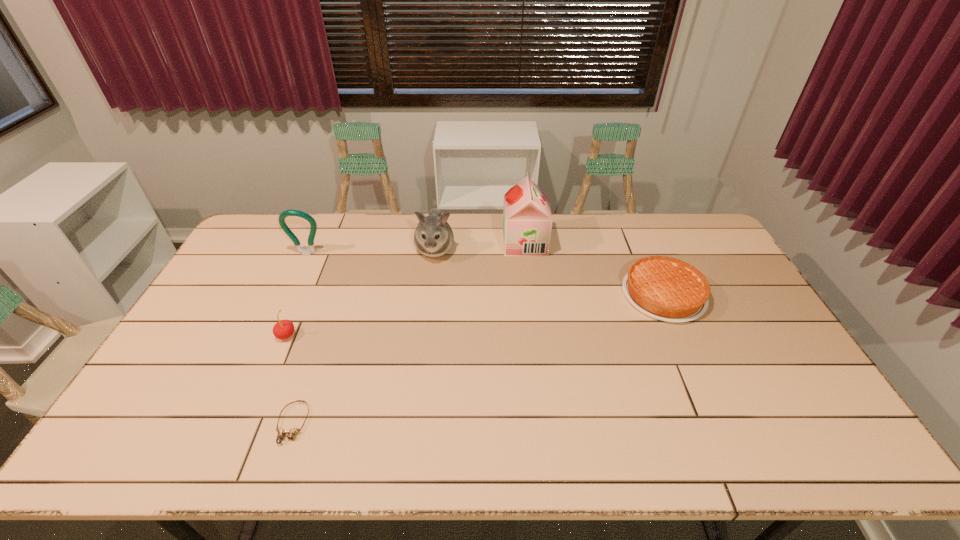
Image resolution: width=960 pixels, height=540 pixels. What are the coordinates of `object that is at the near edge` in the screenshot? It's located at (292, 433).

In order to click on object that is at the right edge in this screenshot , I will do `click(664, 288)`.

In the image, there is a desktop. Find the location of `vacant space at the far edge`. vacant space at the far edge is located at coordinates (651, 232).

Identify the location of vacant space at the left edge of the desktop. The image size is (960, 540). (240, 257).

Where is `free space at the right edge of the desktop`? The height and width of the screenshot is (540, 960). free space at the right edge of the desktop is located at coordinates (752, 365).

You are a GUI agent. You are given a task and a screenshot of the screen. Output one action in this format:
    pyautogui.click(x=<x>, y=<y>)
    Task: Click on the vacant space at the near left corner of the desktop
    This screenshot has height=540, width=960.
    Given the screenshot: What is the action you would take?
    pyautogui.click(x=158, y=435)

Where is `unoccupied area between the fourth object from left to right and the fifth object from left to right`? The height and width of the screenshot is (540, 960). unoccupied area between the fourth object from left to right and the fifth object from left to right is located at coordinates (480, 246).

In order to click on free spot between the fifth object from left to right and the nearest object in this screenshot , I will do `click(409, 333)`.

The image size is (960, 540). What are the coordinates of `free point between the hamster and the goggles` in the screenshot? It's located at point(364,336).

Identify the location of free area in between the third object from right to left and the fifth object from left to right. The width and height of the screenshot is (960, 540). (480, 246).